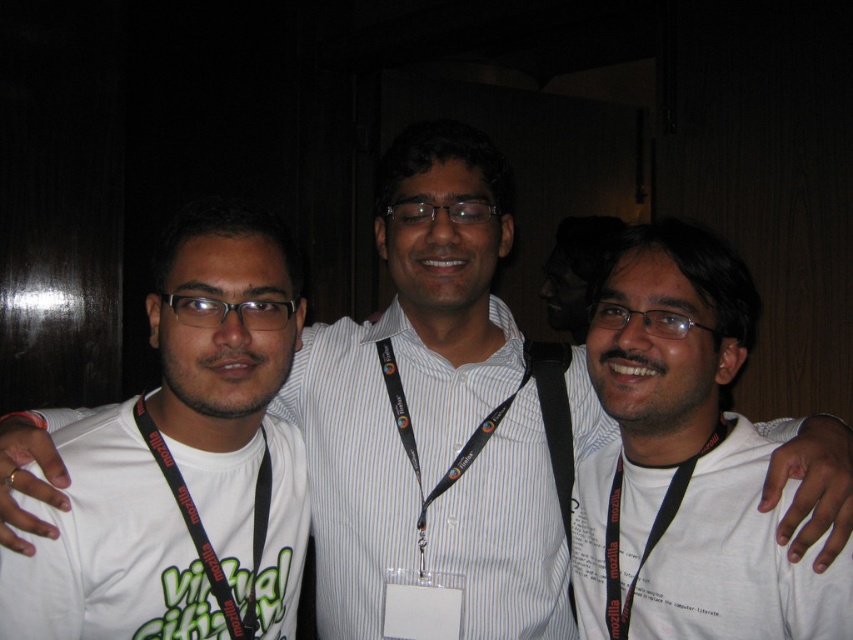
Is white matte t-shirt at left positioned behind black fabric lanyard at center?

No, white matte t-shirt at left is in front of black fabric lanyard at center.

Find the location of `white matte t-shirt at left`. white matte t-shirt at left is located at coordinates (233, 390).

Who is more distant from viewer, (91, 422) or (697, 458)?

Positioned behind is point (697, 458).

Image resolution: width=853 pixels, height=640 pixels. In order to click on white matte t-shirt at left in this screenshot , I will do `click(233, 390)`.

Which of these two, white matte t-shirt at left or black fabric lanyard at left, stands shorter?

black fabric lanyard at left

Which is below, white matte t-shirt at left or black fabric lanyard at left?

black fabric lanyard at left is lower down.

Is point (213, 368) less distant than point (206, 548)?

Yes.

Locate an element on the screen. The width and height of the screenshot is (853, 640). white matte t-shirt at left is located at coordinates (233, 390).

Can you confirm if white matte t-shirt at center is positioned above black fabric lanyard at center?

Correct, white matte t-shirt at center is located above black fabric lanyard at center.

Can you confirm if white matte t-shirt at center is bigger than black fabric lanyard at center?

Yes, white matte t-shirt at center is bigger than black fabric lanyard at center.

Which is in front, point (631, 228) or point (624, 605)?

Positioned in front is point (624, 605).

Find the location of `white matte t-shirt at center`. white matte t-shirt at center is located at coordinates (683, 461).